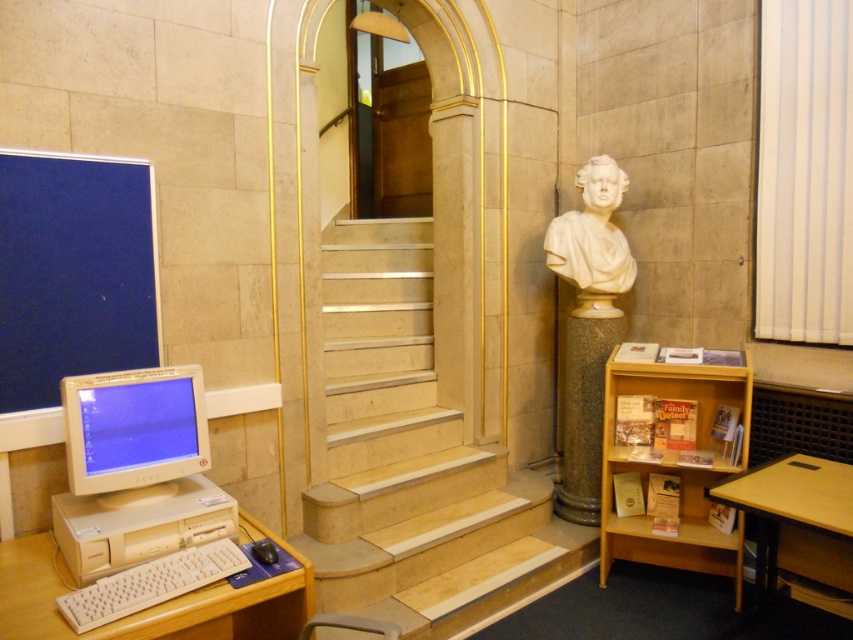
Question: Estimate the real-world distances between objects in this image. Which object is farther from the beige marble stairs at center?

Choices:
 (A) wooden at right
 (B) white marble bust at center-right

Answer: (A)

Question: Which point is closer to the camera?

Choices:
 (A) (329, 467)
 (B) (654, 545)

Answer: (A)

Question: Is beige marble stairs at center positioned at the back of blue matte monitor at left?

Choices:
 (A) no
 (B) yes

Answer: (B)

Question: Which is nearer to the wooden at right?

Choices:
 (A) white plastic table at lower left
 (B) beige marble stairs at center
 (C) granite column at right
 (D) blue matte monitor at left

Answer: (C)

Question: Is wooden at right positioned at the back of granite column at right?

Choices:
 (A) no
 (B) yes

Answer: (A)

Question: Where is blue matte monitor at left located in relation to beige plastic desktop computer at left in the image?

Choices:
 (A) right
 (B) left

Answer: (B)